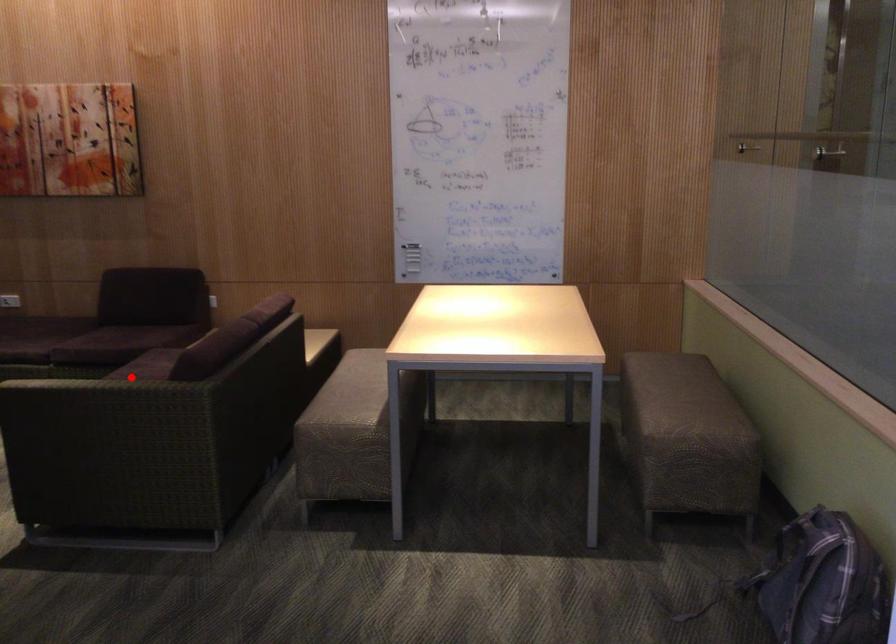
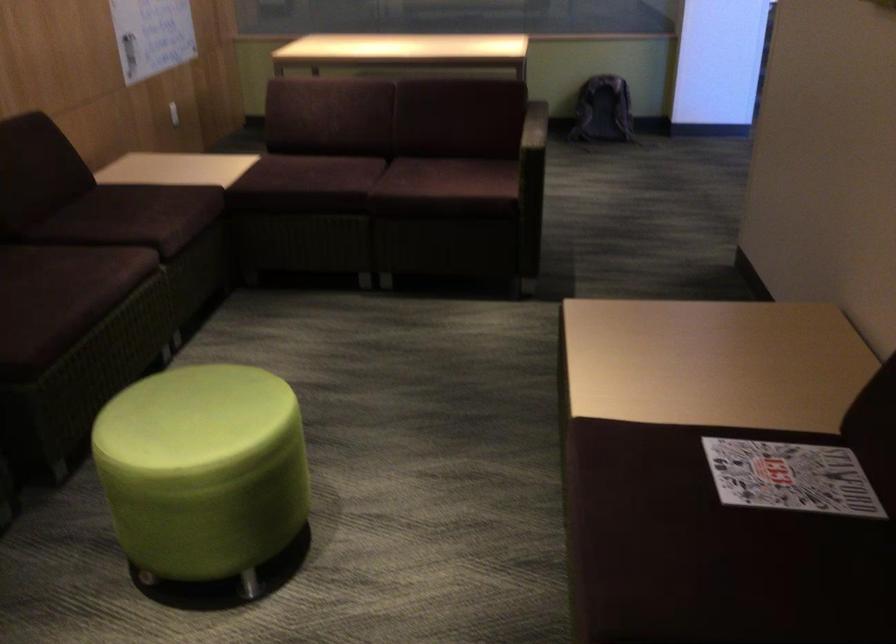
The point at the highlighted location is marked in the first image. Where is the corresponding point in the second image?

(371, 185)